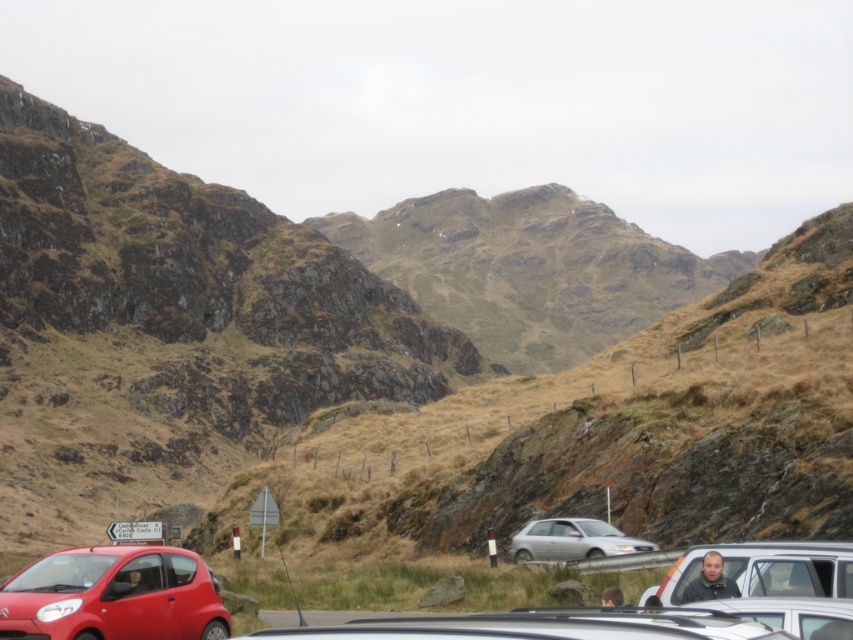
You are a hiker planning to cross the road between the matte silver van at lower right and the satin silver sedan at center. Considering the size of the vehicles, which one would block your view more if you stand near them?

The matte silver van at lower right is bigger than the satin silver sedan at center, so it would block your view more.

You are a hiker trying to reach the shiny red car at lower left from the matte silver van at lower right. Given the mountainous terrain described, which direction should you head to reach the car?

The shiny red car at lower left is located above the matte silver van at lower right, so you should head upwards to reach it.